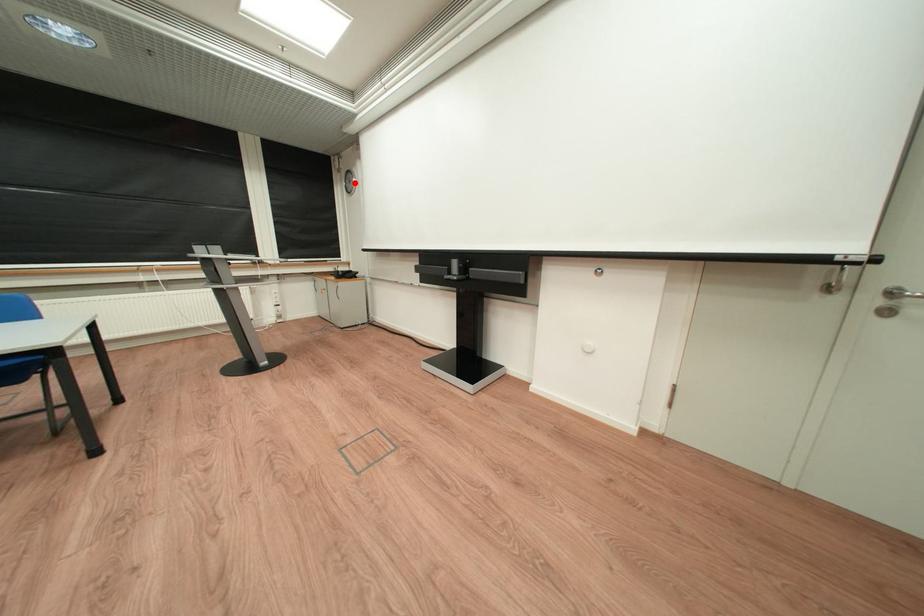
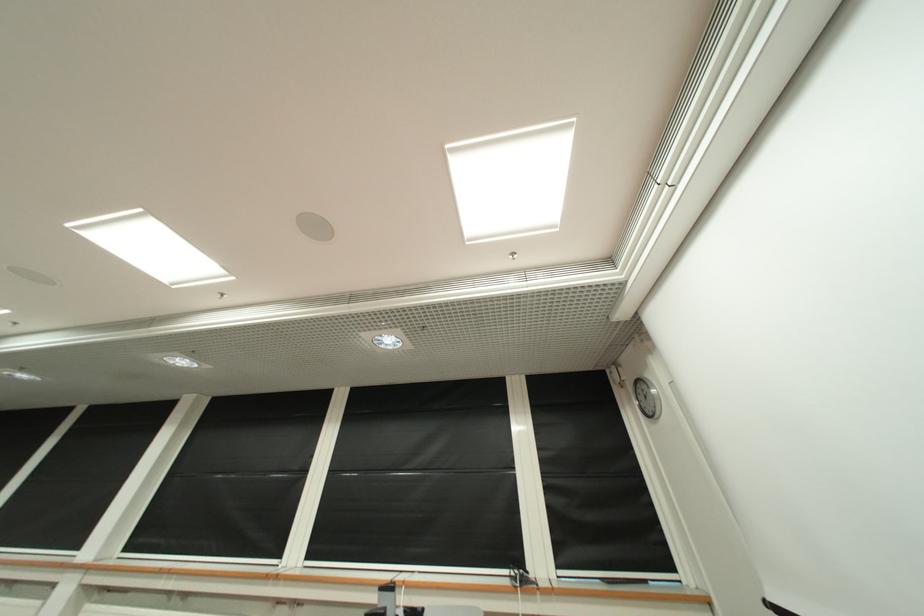
The point at the highlighted location is marked in the first image. Where is the corresponding point in the second image?

(642, 402)